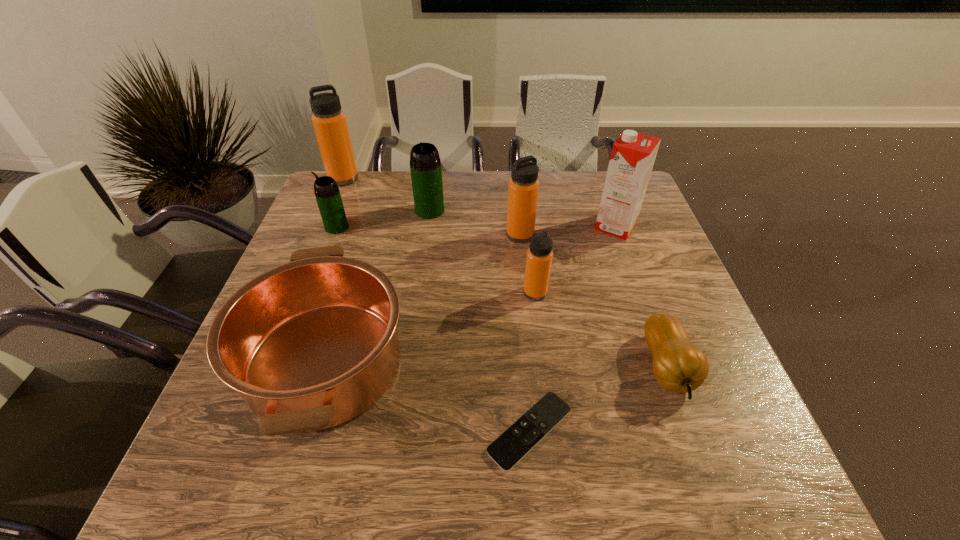
I want to click on object that is at the far right corner, so click(x=633, y=154).

The height and width of the screenshot is (540, 960). What are the coordinates of `free space at the far edge of the desktop` in the screenshot? It's located at (402, 194).

Where is `blank space at the left edge of the desktop`? blank space at the left edge of the desktop is located at coordinates (258, 436).

Image resolution: width=960 pixels, height=540 pixels. I want to click on vacant space at the right edge of the desktop, so click(720, 368).

This screenshot has height=540, width=960. What are the coordinates of `vacant region at the far left corner of the desktop` in the screenshot? It's located at (378, 171).

Locate an element on the screen. This screenshot has height=540, width=960. free space between the remote control and the fourth nearest thermos bottle is located at coordinates (480, 321).

At what (x,y) coordinates should I click in order to perform the action: click on vacant space that is in between the farthest orange thermos bottle and the shortest object. Please return your answer as a coordinate pair (x, y). This screenshot has width=960, height=540. Looking at the image, I should click on (437, 305).

This screenshot has width=960, height=540. Identify the location of blank region between the eighth tallest object and the third thermos bottle from right to left. (548, 289).

The width and height of the screenshot is (960, 540). Find the location of `blank region between the second smallest orange thermos bottle and the black remote control`. blank region between the second smallest orange thermos bottle and the black remote control is located at coordinates (525, 333).

Find the location of a particular element. The image size is (960, 540). vacant space in between the second biggest orange thermos bottle and the carton is located at coordinates (567, 231).